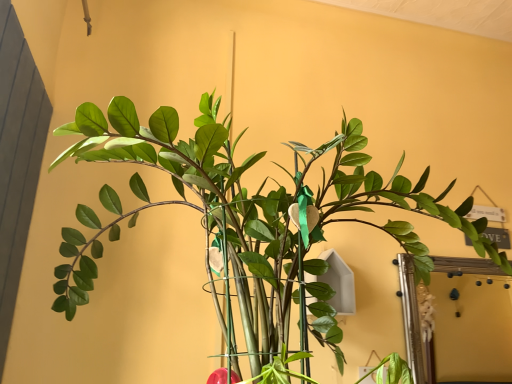
The image size is (512, 384). What do you see at coordinates (411, 319) in the screenshot? I see `wooden-framed mirror at right` at bounding box center [411, 319].

This screenshot has width=512, height=384. Find the location of `wooden-framed mirror at right`. wooden-framed mirror at right is located at coordinates (411, 319).

This screenshot has width=512, height=384. I want to click on wooden-framed mirror at right, so click(x=411, y=319).